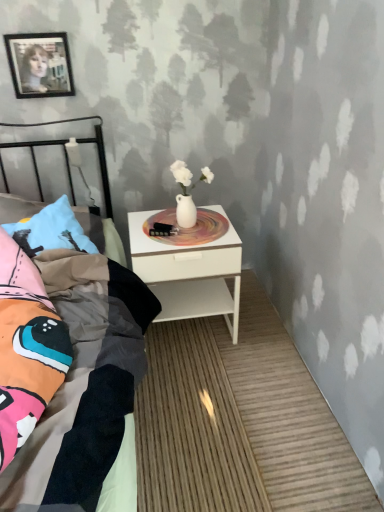
Image resolution: width=384 pixels, height=512 pixels. Find the location of `free space in front of white glossy nightstand at center`. free space in front of white glossy nightstand at center is located at coordinates (204, 383).